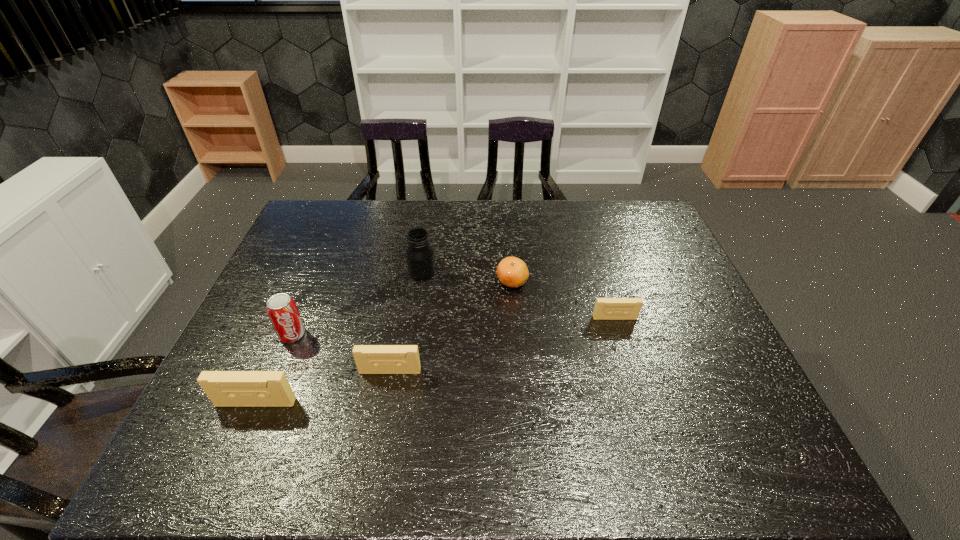
The width and height of the screenshot is (960, 540). Find the location of `vacant area at the near edge`. vacant area at the near edge is located at coordinates (382, 412).

Image resolution: width=960 pixels, height=540 pixels. What are the coordinates of `vacant area at the right edge of the desktop` in the screenshot? It's located at (714, 335).

In the image, there is a desktop. At what (x,y) coordinates should I click in order to perform the action: click on free region at the far right corner. Please return your answer as a coordinate pair (x, y). Looking at the image, I should click on [627, 207].

Locate an element on the screen. Image resolution: width=960 pixels, height=540 pixels. vacant point located between the second tallest object and the nearest videotape is located at coordinates (274, 369).

Where is `free space between the second tallest videotape and the shortest videotape`? The height and width of the screenshot is (540, 960). free space between the second tallest videotape and the shortest videotape is located at coordinates (502, 345).

Identify the location of free space between the fifth object from left to right and the fifth shortest object. (402, 308).

Locate an element on the screen. This screenshot has height=540, width=960. vacant region between the second object from right to left and the shortest videotape is located at coordinates (564, 300).

The height and width of the screenshot is (540, 960). In order to click on free point between the second nearest videotape and the clementine in this screenshot , I will do `click(451, 326)`.

Identify the location of vacant area that lies between the second nearest object and the rightmost videotape. This screenshot has width=960, height=540. (502, 345).

You are a GUI agent. You are given a task and a screenshot of the screen. Output one action in this format:
    pyautogui.click(x=<x>, y=<y>)
    Task: Click on the free area in between the jar and the nearest object
    The height and width of the screenshot is (540, 960).
    Given the screenshot: What is the action you would take?
    pyautogui.click(x=339, y=338)